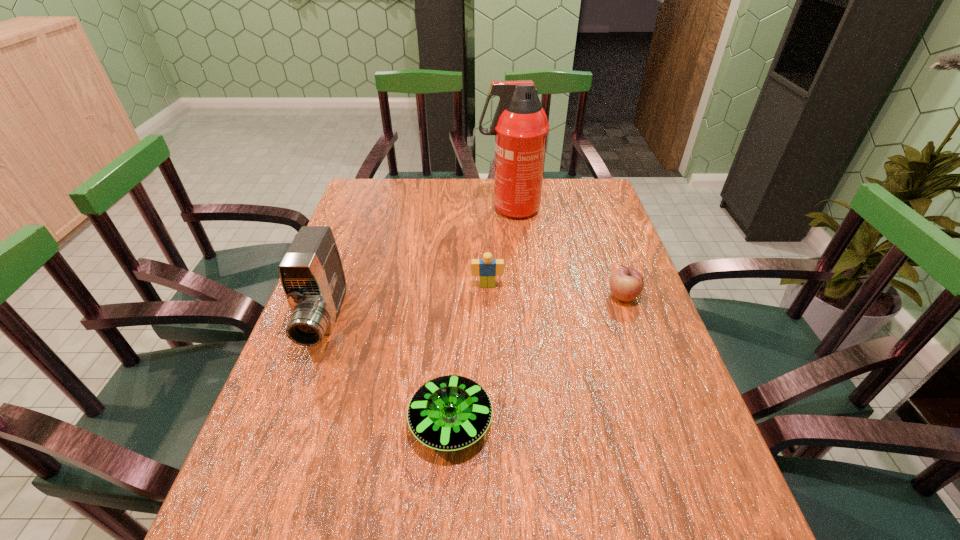
Image resolution: width=960 pixels, height=540 pixels. Find the location of `free space located 0.070m on the trigger side of the farthest object`. free space located 0.070m on the trigger side of the farthest object is located at coordinates (458, 209).

Locate an element on the screen. The image size is (960, 540). vacant space located 0.320m at the front of the leftmost object, highlighting the lens is located at coordinates (255, 511).

Identify the location of free space located 0.350m on the face of the Lego. (490, 402).

The height and width of the screenshot is (540, 960). Identify the location of vacant area situated on the front of the rightmost object. (665, 416).

I want to click on vacant region located on the left of the nearest object, so click(x=329, y=422).

Where is `object that is at the far edge`? This screenshot has height=540, width=960. object that is at the far edge is located at coordinates (520, 125).

Locate an element on the screen. The height and width of the screenshot is (540, 960). object that is at the left edge is located at coordinates (311, 272).

Image resolution: width=960 pixels, height=540 pixels. I want to click on object that is at the right edge, so click(x=626, y=284).

In the image, there is a desktop. Where is `free space at the far edge`? free space at the far edge is located at coordinates (427, 200).

The height and width of the screenshot is (540, 960). What are the coordinates of `vacant space at the left edge of the desktop` in the screenshot? It's located at (393, 229).